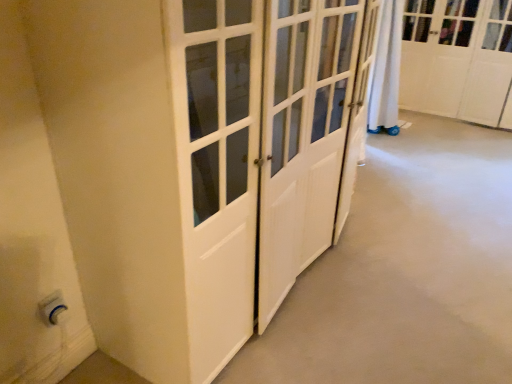
Question: From the image's perspective, is white plastic electric outlet at lower left beneath white glossy cabinet at upper right?

Choices:
 (A) yes
 (B) no

Answer: (A)

Question: Does white plastic electric outlet at lower left have a lesser height compared to white glossy cabinet at upper right?

Choices:
 (A) yes
 (B) no

Answer: (A)

Question: From a real-world perspective, is white plastic electric outlet at lower left located higher than white glossy cabinet at upper right?

Choices:
 (A) no
 (B) yes

Answer: (A)

Question: From the image's perspective, is white plastic electric outlet at lower left over white glossy cabinet at upper right?

Choices:
 (A) no
 (B) yes

Answer: (A)

Question: Would you say white glossy cabinet at upper right is part of white plastic electric outlet at lower left's contents?

Choices:
 (A) yes
 (B) no

Answer: (B)

Question: Is white plastic electric outlet at lower left thinner than white glossy cabinet at upper right?

Choices:
 (A) no
 (B) yes

Answer: (B)

Question: Is white glossy cabinet at upper right positioned far away from white plastic electric outlet at lower left?

Choices:
 (A) no
 (B) yes

Answer: (B)

Question: From a real-world perspective, is white glossy cabinet at upper right below white plastic electric outlet at lower left?

Choices:
 (A) no
 (B) yes

Answer: (A)

Question: Is white glossy cabinet at upper right facing away from white plastic electric outlet at lower left?

Choices:
 (A) no
 (B) yes

Answer: (A)

Question: Could you tell me if white glossy cabinet at upper right is turned towards white plastic electric outlet at lower left?

Choices:
 (A) yes
 (B) no

Answer: (A)

Question: Is white glossy cabinet at upper right next to white plastic electric outlet at lower left?

Choices:
 (A) no
 (B) yes

Answer: (A)

Question: Considering the relative sizes of white glossy cabinet at upper right and white plastic electric outlet at lower left in the image provided, is white glossy cabinet at upper right shorter than white plastic electric outlet at lower left?

Choices:
 (A) no
 (B) yes

Answer: (A)

Question: In terms of width, does white glossy cabinet at upper right look wider or thinner when compared to white plastic electric outlet at lower left?

Choices:
 (A) wide
 (B) thin

Answer: (A)